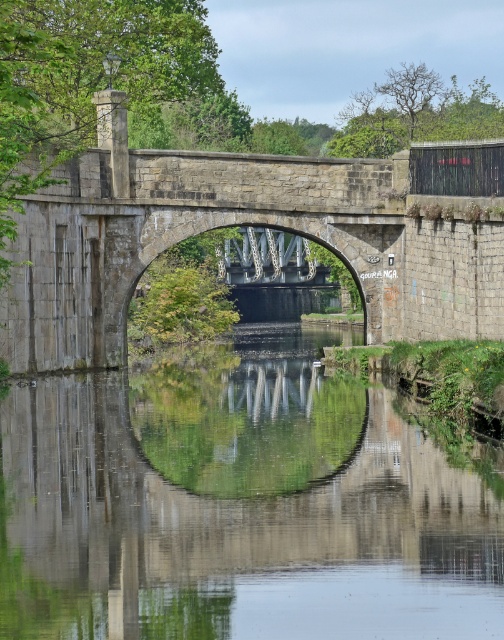
Question: Is transparent water at center behind stone bridge at center?

Choices:
 (A) no
 (B) yes

Answer: (A)

Question: Among these objects, which one is nearest to the camera?

Choices:
 (A) stone bridge at center
 (B) transparent water at center

Answer: (B)

Question: Does transparent water at center have a lesser width compared to stone bridge at center?

Choices:
 (A) yes
 (B) no

Answer: (A)

Question: Does transparent water at center appear on the left side of stone bridge at center?

Choices:
 (A) yes
 (B) no

Answer: (A)